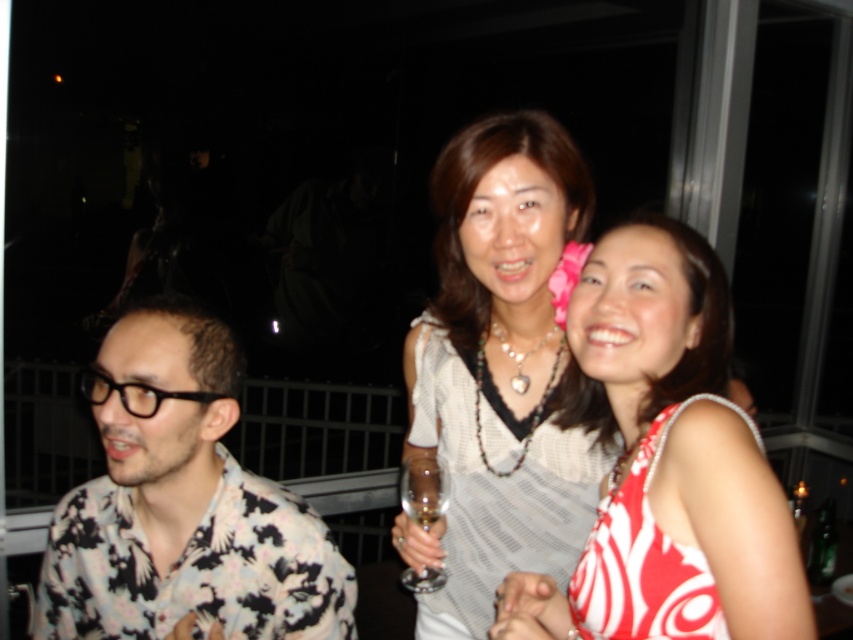
Where is `red and white printed dress at center`? This screenshot has height=640, width=853. red and white printed dress at center is located at coordinates (668, 464).

Is point (664, 474) farther from camera compared to point (440, 509)?

No.

Where is `red and white printed dress at center`? Image resolution: width=853 pixels, height=640 pixels. red and white printed dress at center is located at coordinates (668, 464).

Who is lower down, white textured dress at center or red printed fabric dress at lower right?

red printed fabric dress at lower right is lower down.

Is point (447, 502) positioned before point (619, 570)?

No, it is not.

Locate an element on the screen. The image size is (853, 640). white textured dress at center is located at coordinates (496, 492).

Which is below, red and white printed dress at center or white textured dress at center?

white textured dress at center is lower down.

Is point (631, 499) in front of point (534, 557)?

Yes, it is.

Does point (628, 275) come behind point (468, 518)?

No, it is not.

Where is `red and white printed dress at center`? This screenshot has width=853, height=640. red and white printed dress at center is located at coordinates (668, 464).